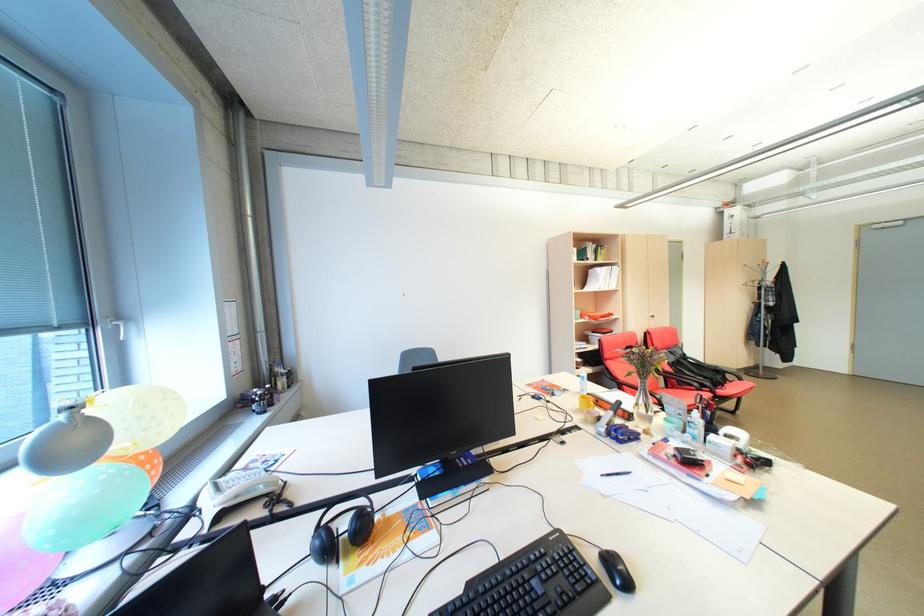
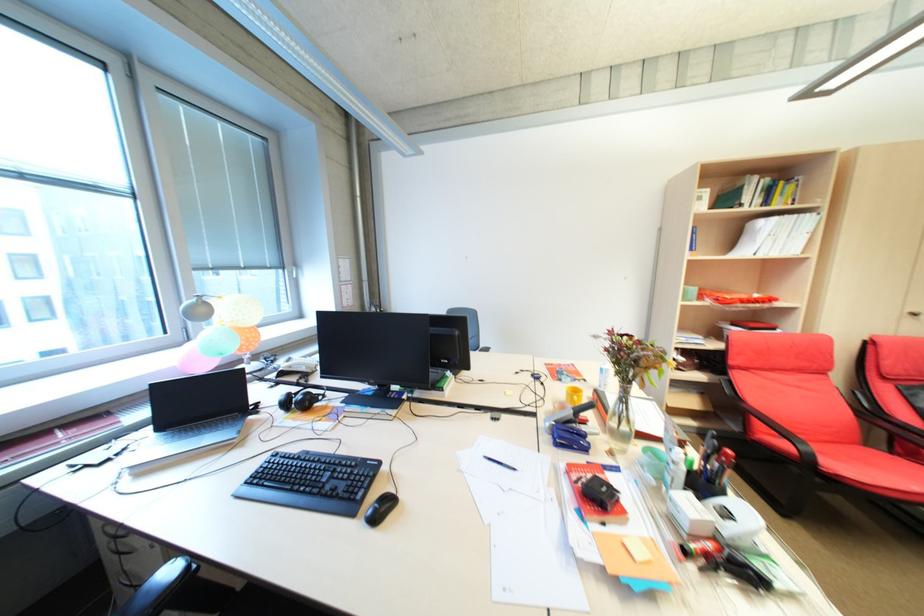
In the second image, find the point that corresponds to (627,582) in the first image.

(379, 514)